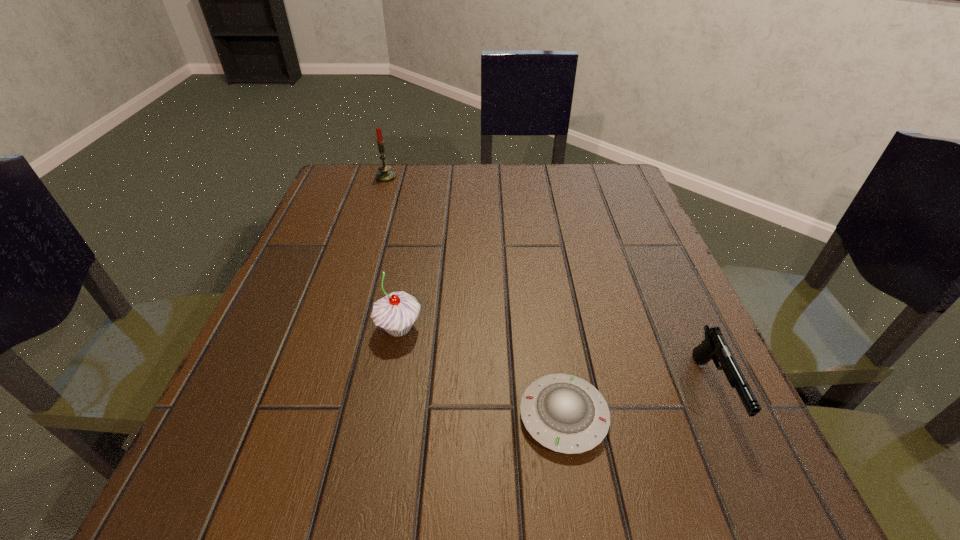
At what (x,y) coordinates should I click in order to perform the action: click on free space located 0.090m at the aiming end of the rightmost object. Please return your answer as a coordinate pair (x, y). The image size is (960, 540). Looking at the image, I should click on (767, 510).

Find the location of `free space located 0.080m on the left of the shortest object`. free space located 0.080m on the left of the shortest object is located at coordinates (463, 416).

Where is `object at the far edge`? object at the far edge is located at coordinates (385, 175).

Identify the location of object that is at the near edge. The width and height of the screenshot is (960, 540). click(564, 413).

At what (x,y) coordinates should I click in order to perform the action: click on object located at the left edge. Please return your answer as a coordinate pair (x, y). Looking at the image, I should click on (385, 175).

Locate an element on the screen. object present at the right edge is located at coordinates (714, 347).

The image size is (960, 540). Find the location of `object that is at the far left corner`. object that is at the far left corner is located at coordinates (385, 175).

Image resolution: width=960 pixels, height=540 pixels. In the image, there is a desktop. What are the coordinates of `vacant space at the far edge` in the screenshot? It's located at (454, 165).

Where is `free location at the near edge`? free location at the near edge is located at coordinates (344, 453).

Locate an element on the screen. vacant space at the left edge of the desktop is located at coordinates (327, 245).